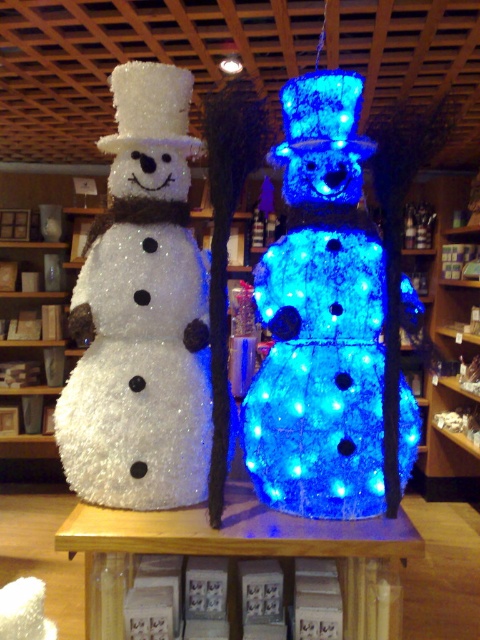
Question: Which object is closer to the camera taking this photo?

Choices:
 (A) blue led-lit snowman at center
 (B) white glittery snowman at left

Answer: (A)

Question: Is blue led-lit snowman at center thinner than white glittery snowman at left?

Choices:
 (A) yes
 (B) no

Answer: (B)

Question: Does blue led-lit snowman at center have a larger size compared to white glittery snowman at left?

Choices:
 (A) no
 (B) yes

Answer: (B)

Question: Which object appears closest to the camera in this image?

Choices:
 (A) blue led-lit snowman at center
 (B) white glittery snowman at left

Answer: (A)

Question: Does blue led-lit snowman at center have a lesser width compared to white glittery snowman at left?

Choices:
 (A) yes
 (B) no

Answer: (B)

Question: Which point appears closest to the camera in this image?

Choices:
 (A) (245, 419)
 (B) (145, 177)

Answer: (A)